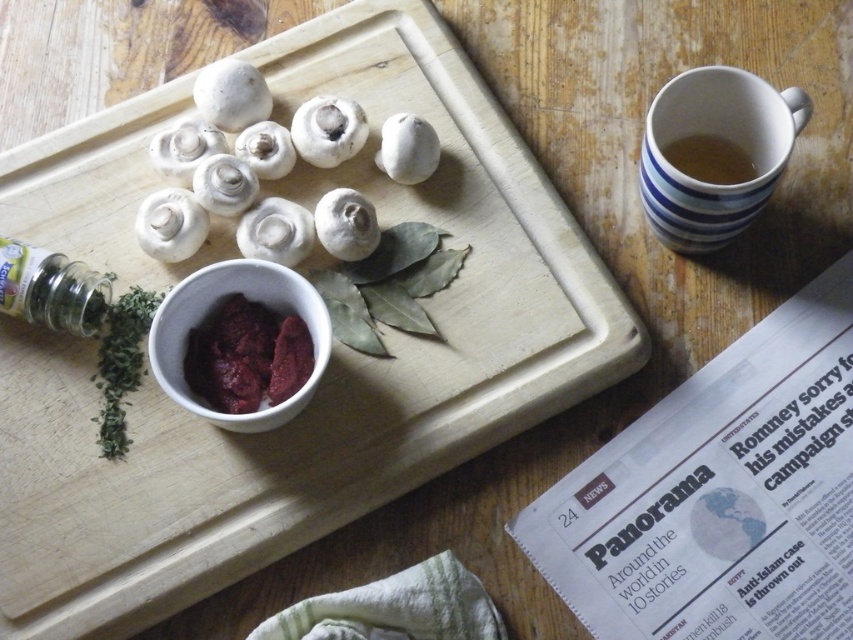
Question: Which point appears farthest from the camera in this image?

Choices:
 (A) (350, 109)
 (B) (62, 292)
 (C) (247, 355)

Answer: (A)

Question: Is dark red paste at center closer to camera compared to brown ceramic mug at upper right?

Choices:
 (A) no
 (B) yes

Answer: (B)

Question: Which of the following is the closest to the observer?

Choices:
 (A) brown ceramic mug at upper right
 (B) blue striped mug at upper right

Answer: (B)

Question: Is green leafy rosemary at lower left closer to camera compared to white matte mushroom at upper center?

Choices:
 (A) no
 (B) yes

Answer: (B)

Question: Which object appears closest to the camera in this image?

Choices:
 (A) blue striped mug at upper right
 (B) dark red paste at center

Answer: (A)

Question: Observing the image, what is the correct spatial positioning of blue striped mug at upper right in reference to green glass jar at lower left?

Choices:
 (A) above
 (B) below

Answer: (A)